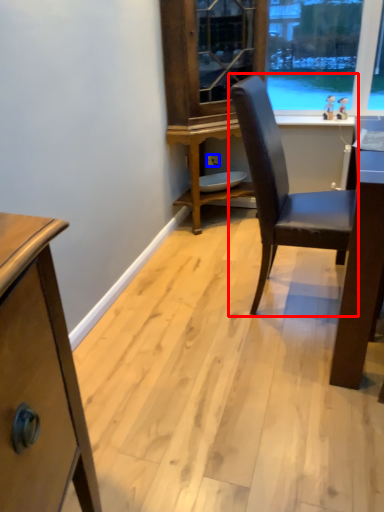
Question: Which object appears farthest to the camera in this image, chair (highlighted by a red box) or power outlet (highlighted by a blue box)?

Choices:
 (A) chair
 (B) power outlet

Answer: (B)